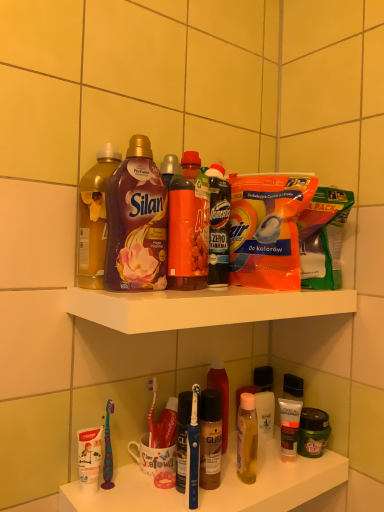
At what (x,y) coordinates should I click in order to perform the action: click on vacant area that is in front of translucent plastic bottle at center, the first bottle from the back. Please return your answer as a coordinate pair (x, y). Looking at the image, I should click on (218, 485).